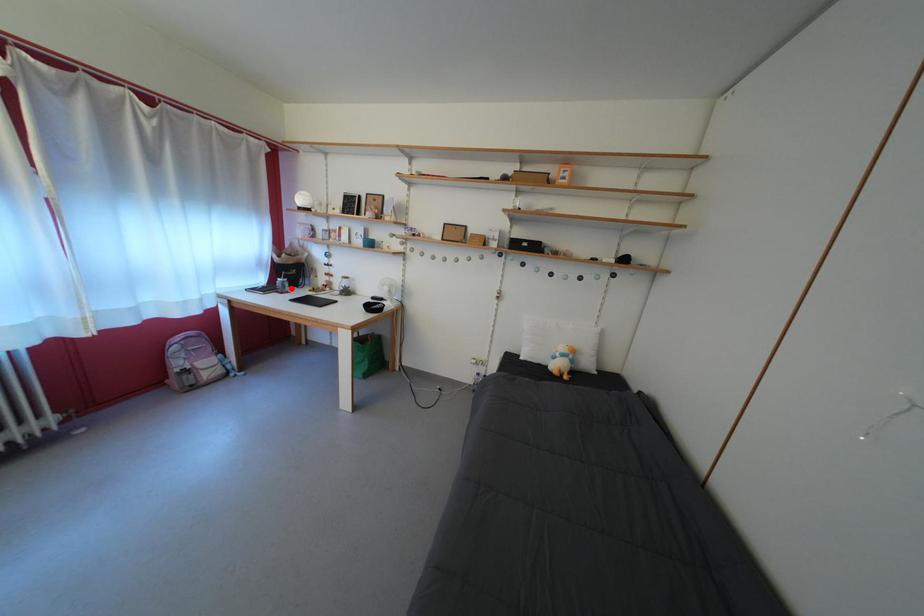
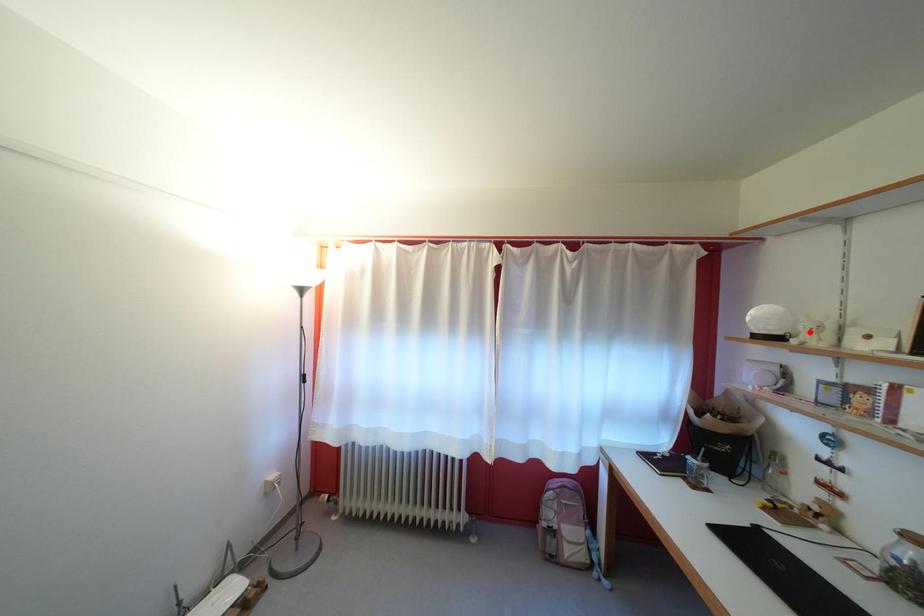
I am providing you with two images of the same scene from different viewpoints. A red point is marked on the first image and another point is marked on the second image. Do the highlighted points in image1 and image2 indicate the same real-world spot?

No